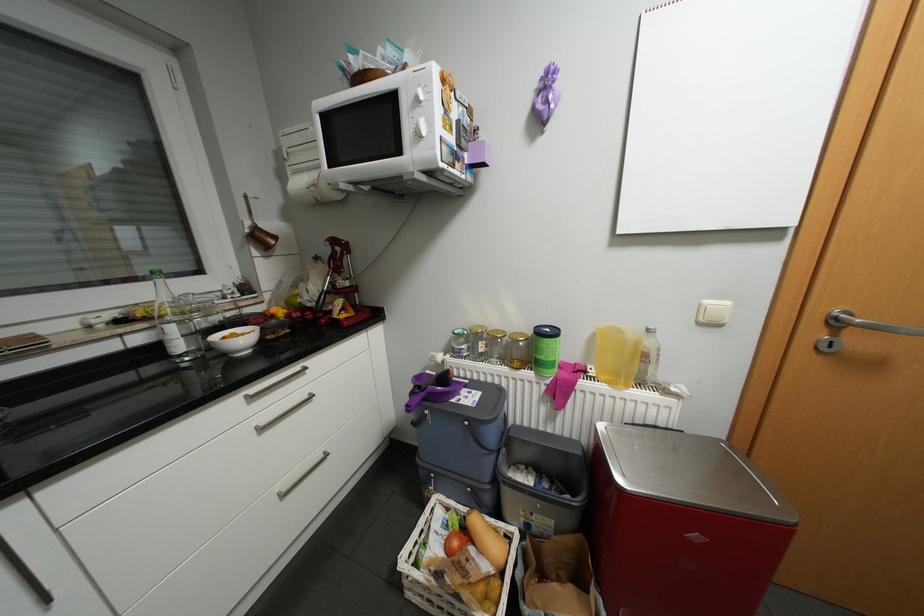
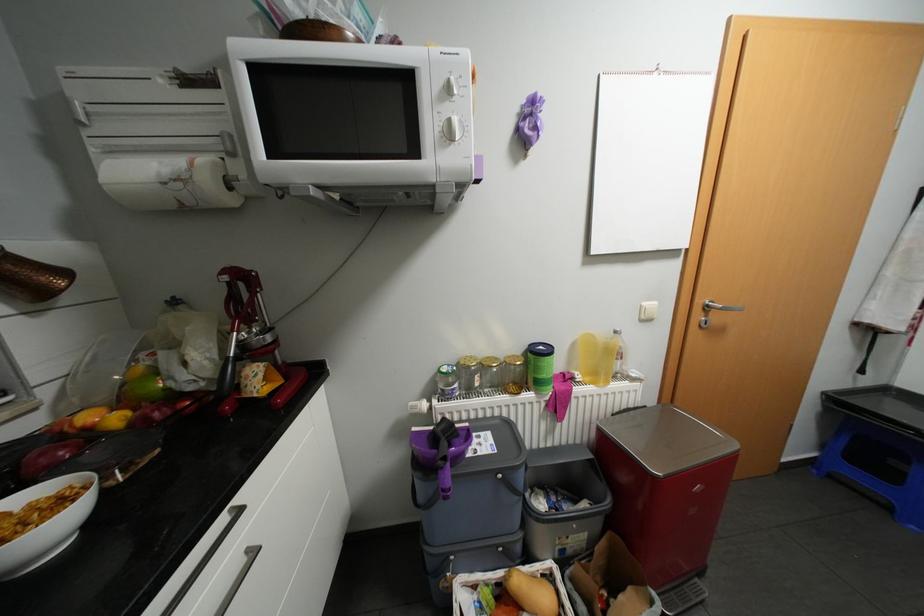
In the second image, find the point that corresponds to (317,392) in the first image.

(256, 549)